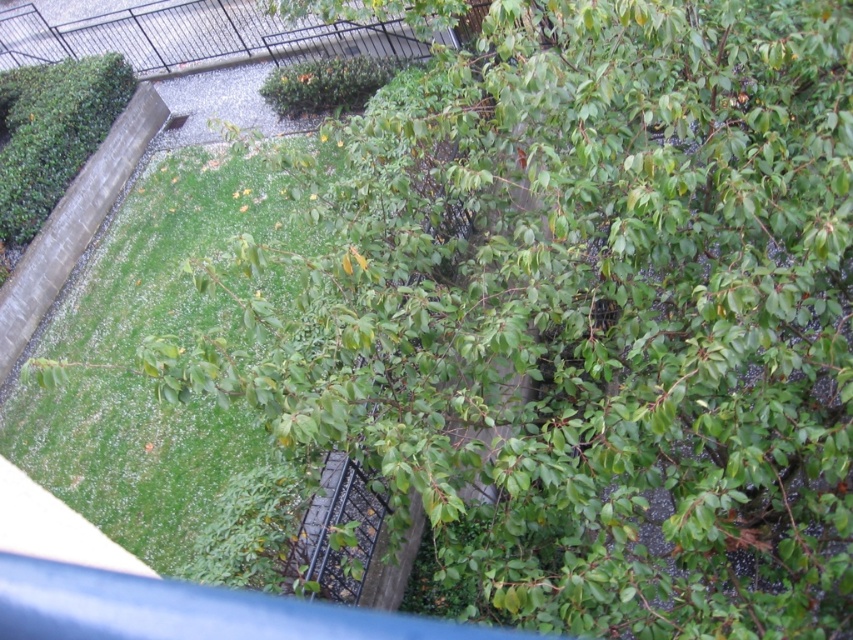
Does green leafy bush at upper left appear under green leafy bush at center?

Indeed, green leafy bush at upper left is positioned under green leafy bush at center.

Between point (4, 128) and point (308, 109), which one is positioned in front?

Point (308, 109)

Locate an element on the screen. green leafy bush at upper left is located at coordinates 51,132.